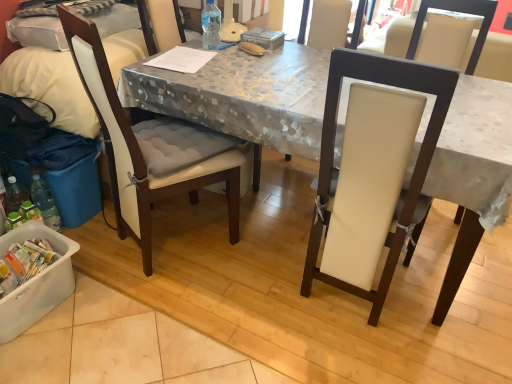
Question: Is white plastic container at lower left positioned with its back to white leather chair at center, acting as the first chair starting from the right?

Choices:
 (A) yes
 (B) no

Answer: (B)

Question: Does white plastic container at lower left lie in front of white leather chair at center, which appears as the second chair when viewed from the left?

Choices:
 (A) no
 (B) yes

Answer: (A)

Question: Is white plastic container at lower left surrounding white leather chair at center, acting as the first chair starting from the right?

Choices:
 (A) no
 (B) yes

Answer: (A)

Question: Considering the relative sizes of white plastic container at lower left and white leather chair at center, acting as the first chair starting from the right, in the image provided, is white plastic container at lower left bigger than white leather chair at center, acting as the first chair starting from the right,?

Choices:
 (A) yes
 (B) no

Answer: (B)

Question: Considering the relative sizes of white plastic container at lower left and white leather chair at center, acting as the first chair starting from the right, in the image provided, is white plastic container at lower left shorter than white leather chair at center, acting as the first chair starting from the right,?

Choices:
 (A) no
 (B) yes

Answer: (B)

Question: Considering the relative sizes of white plastic container at lower left and white leather chair at center, acting as the first chair starting from the right, in the image provided, is white plastic container at lower left wider than white leather chair at center, acting as the first chair starting from the right,?

Choices:
 (A) yes
 (B) no

Answer: (B)

Question: Is the surface of white leather chair at center, acting as the first chair starting from the right, in direct contact with transparent plastic bottle at table center?

Choices:
 (A) no
 (B) yes

Answer: (A)

Question: From the image's perspective, would you say white leather chair at center, which appears as the second chair when viewed from the left, is shown under transparent plastic bottle at table center?

Choices:
 (A) yes
 (B) no

Answer: (A)

Question: Considering the relative positions of white leather chair at center, acting as the first chair starting from the right, and transparent plastic bottle at table center in the image provided, is white leather chair at center, acting as the first chair starting from the right, to the left of transparent plastic bottle at table center from the viewer's perspective?

Choices:
 (A) no
 (B) yes

Answer: (A)

Question: Is transparent plastic bottle at table center located within white leather chair at center, acting as the first chair starting from the right?

Choices:
 (A) no
 (B) yes

Answer: (A)

Question: From the image's perspective, is white leather chair at center, which appears as the second chair when viewed from the left, on top of transparent plastic bottle at table center?

Choices:
 (A) no
 (B) yes

Answer: (A)

Question: From a real-world perspective, is white leather chair at center, which appears as the second chair when viewed from the left, on top of transparent plastic bottle at table center?

Choices:
 (A) no
 (B) yes

Answer: (A)

Question: Can you confirm if white fabric-covered desk at center is smaller than white padded chair at left, the 2th chair positioned from the right?

Choices:
 (A) no
 (B) yes

Answer: (A)